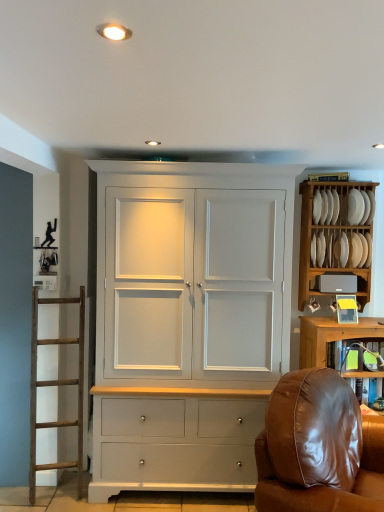
Question: Is brown leather chair at lower right in front of or behind matte white light fixture at upper center in the image?

Choices:
 (A) behind
 (B) front

Answer: (A)

Question: Do you think brown leather chair at lower right is within matte white light fixture at upper center, or outside of it?

Choices:
 (A) inside
 (B) outside

Answer: (B)

Question: Which is farther from the brown leather chair at lower right?

Choices:
 (A) matte gray speaker at upper right
 (B) white glossy plate at upper right, arranged as the first plate when viewed from the left
 (C) white wood plate rack at upper right
 (D) white painted wood cupboard at center
 (E) matte white light fixture at upper center

Answer: (E)

Question: Which of these objects is positioned closest to the white matte plate at upper right, the first plate viewed from the right?

Choices:
 (A) white painted wood cupboard at center
 (B) white wood plate rack at upper right
 (C) white glossy plate at upper right, arranged as the first plate when viewed from the left
 (D) brown leather chair at lower right
 (E) matte white light fixture at upper center

Answer: (C)